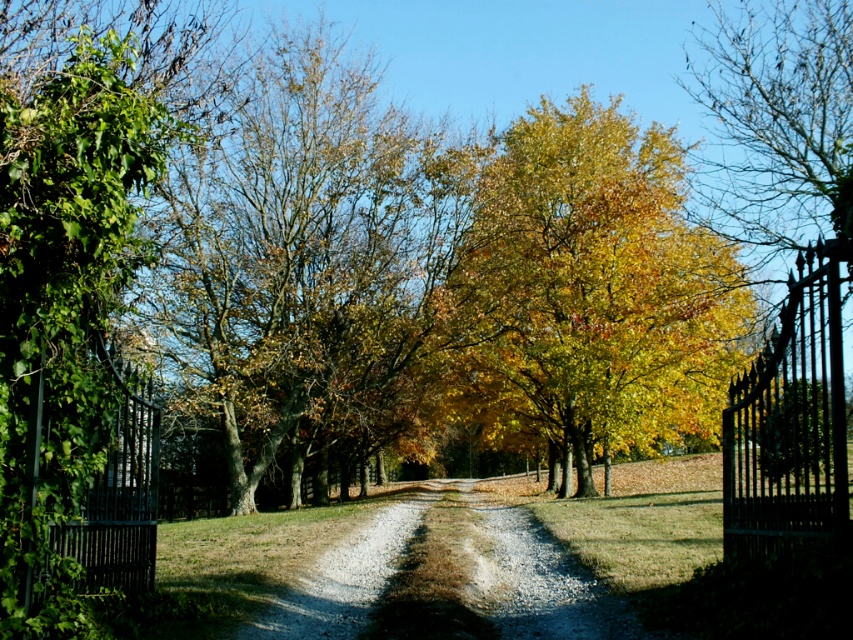
Is green leafy tree at center above golden yellow leaves at center?

No.

Who is more distant from viewer, [397,394] or [650,273]?

Positioned behind is point [397,394].

Find the location of a particular element. This screenshot has height=640, width=853. green leafy tree at center is located at coordinates (303, 257).

Can you confirm if golden yellow leaves at center is smaller than gravelly dirt road at center?

Incorrect, golden yellow leaves at center is not smaller in size than gravelly dirt road at center.

Can you confirm if golden yellow leaves at center is positioned to the left of gravelly dirt road at center?

No, golden yellow leaves at center is not to the left of gravelly dirt road at center.

Locate an element on the screen. golden yellow leaves at center is located at coordinates (592, 292).

Who is taller, gravelly dirt road at center or black wrought iron gate at right?

With more height is gravelly dirt road at center.

Which is below, gravelly dirt road at center or black wrought iron gate at right?

gravelly dirt road at center

Between point (463, 561) and point (764, 348), which one is positioned in front?

Positioned in front is point (764, 348).

This screenshot has height=640, width=853. I want to click on gravelly dirt road at center, so click(x=450, y=577).